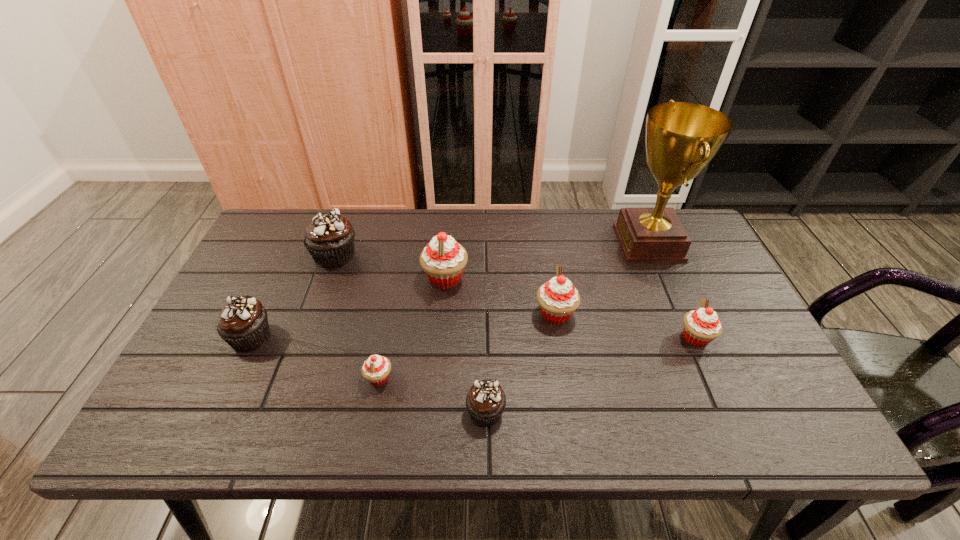
Find the location of a particular element. This screenshot has height=540, width=960. gold award is located at coordinates (681, 138).

The height and width of the screenshot is (540, 960). What are the coordinates of `award` in the screenshot? It's located at (681, 138).

Find the location of a particular element. This screenshot has height=540, width=960. the tallest cupcake is located at coordinates point(443,260).

Identify the location of the second pink cupcake from left to right. This screenshot has width=960, height=540. click(x=443, y=260).

You are a GUI agent. You are given a task and a screenshot of the screen. Output one action in this format:
    pyautogui.click(x=<x>, y=<y>)
    Task: Click on the second cupcake from left to right
    This screenshot has width=960, height=540.
    Given the screenshot: What is the action you would take?
    pyautogui.click(x=329, y=238)

Where is `the biggest brown cupcake`? Image resolution: width=960 pixels, height=540 pixels. the biggest brown cupcake is located at coordinates (329, 238).

I want to click on the second pink cupcake from right to left, so click(x=558, y=298).

I want to click on the second cupcake from right to left, so click(x=558, y=298).

Find the location of a particular element. The height and width of the screenshot is (540, 960). the rightmost pink cupcake is located at coordinates (701, 326).

You are a GUI agent. You are given a task and a screenshot of the screen. Output one action in this format:
    pyautogui.click(x=<x>, y=<y>)
    Task: Click on the third biggest pink cupcake
    This screenshot has height=540, width=960.
    Given the screenshot: What is the action you would take?
    pyautogui.click(x=701, y=326)